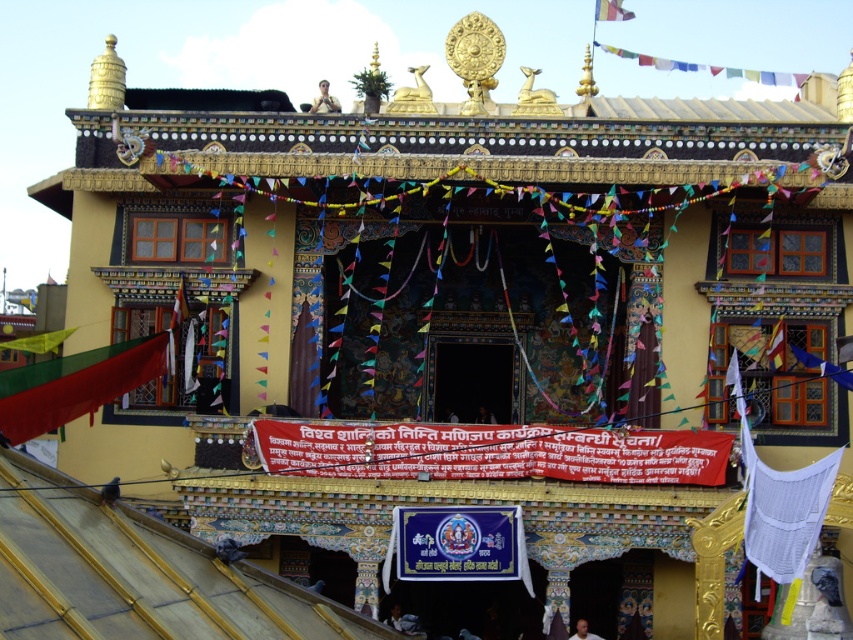
You are a visitor standing in front of the temple. You notice the matte gold statue at upper center and the smooth skin face at center. Which object is positioned to the left of the other?

The matte gold statue at upper center is to the left of the smooth skin face at center.

You are a photographer planning to take a photo of the temple. You want to ensure both the matte gold statue at upper center and the smooth skin face at center are clearly visible. Given their sizes, which object should you focus on first to ensure proper focus, and why?

The matte gold statue at upper center is bigger than the smooth skin face at center, so focusing on the matte gold statue at upper center first will ensure it is sharp, and the smaller smooth skin face at center will likely remain in focus due to its proximity in the scene.